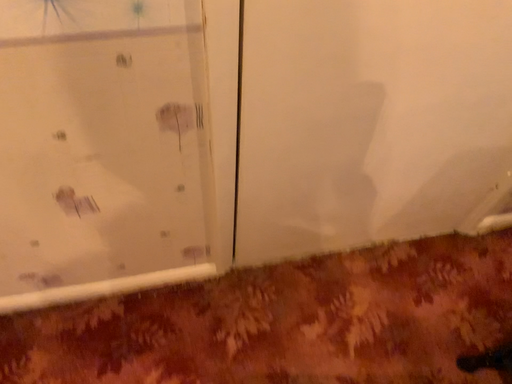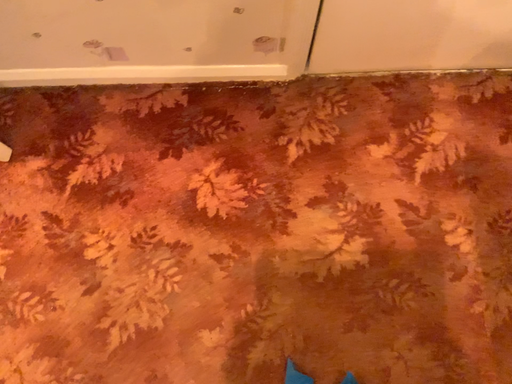
Question: How did the camera likely rotate when shooting the video?

Choices:
 (A) rotated downward
 (B) rotated upward

Answer: (A)